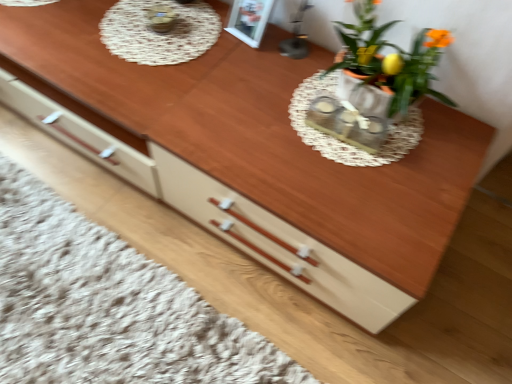
This screenshot has width=512, height=384. Identify the location of free region on the left part of matte orange pot at upper right. (278, 81).